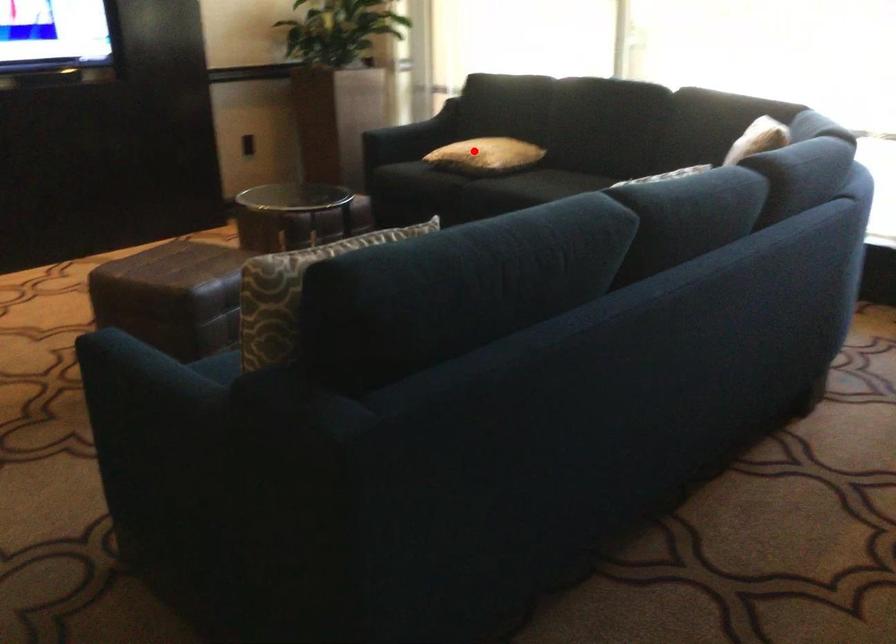
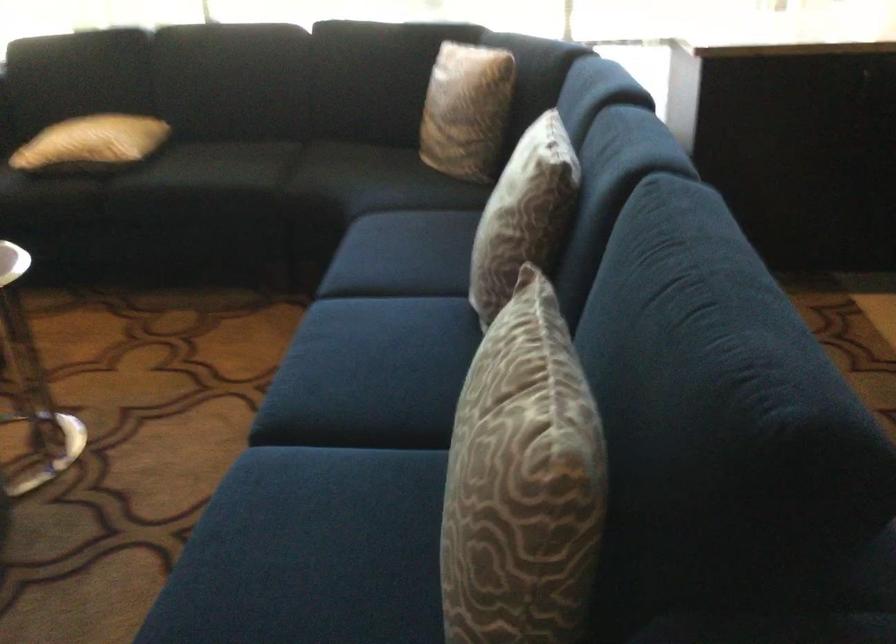
Where in the second image is the point corresponding to the highlighted location from the first image?

(91, 142)